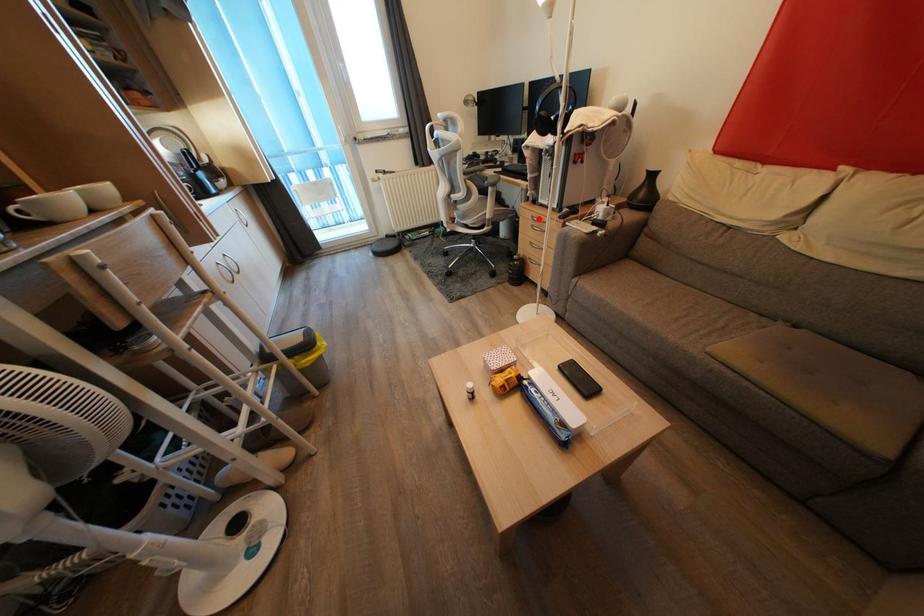
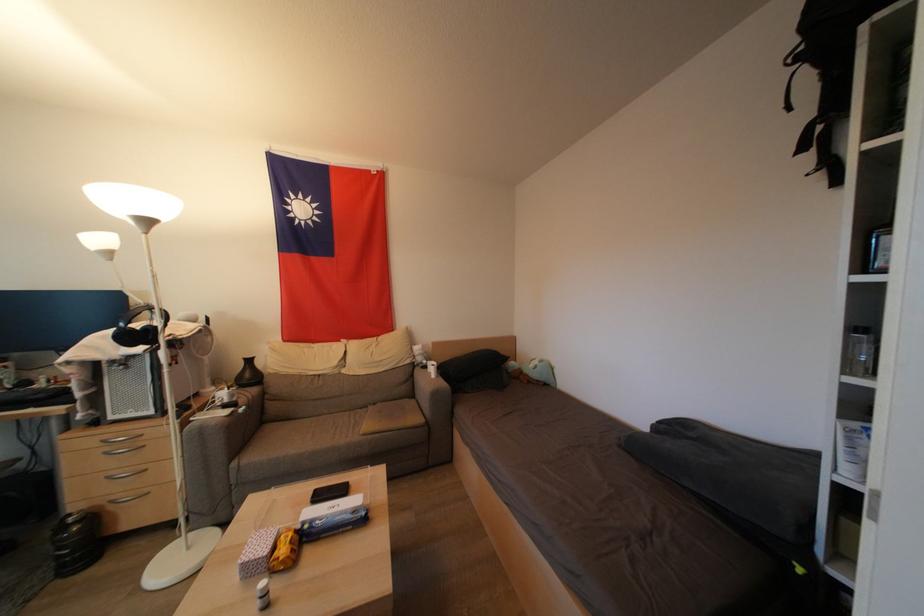
Question: I am providing you with two images of the same scene from different viewpoints. A red point is shown in image1. For the corresponding object point in image2, is it positioned nearer or farther from the camera?

Choices:
 (A) Nearer
 (B) Farther

Answer: (B)